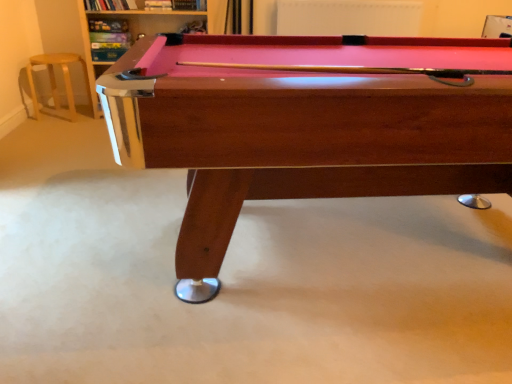
Locate an element on the screen. The image size is (512, 384). light wood bar stool at left is located at coordinates (55, 83).

In order to click on wooden billiard table at center in this screenshot , I will do `click(307, 125)`.

Is light wood bar stool at left to the left of metallic silver pool table at upper left from the viewer's perspective?

Yes.

Does point (70, 110) come behind point (139, 19)?

Yes, it is behind point (139, 19).

Does light wood bar stool at left have a smaller size compared to metallic silver pool table at upper left?

Yes.

From a real-world perspective, relative to light wood bar stool at left, is metallic silver pool table at upper left vertically above or below?

From a real-world perspective, metallic silver pool table at upper left is physically above light wood bar stool at left.

Where is `shelf above the light wood bar stool at left (from a real-world perspective)`? Image resolution: width=512 pixels, height=384 pixels. shelf above the light wood bar stool at left (from a real-world perspective) is located at coordinates (130, 31).

Consider the image. Would you consider metallic silver pool table at upper left to be distant from light wood bar stool at left?

No, metallic silver pool table at upper left is not far from light wood bar stool at left.

Can you confirm if metallic silver pool table at upper left is positioned to the left of light wood bar stool at left?

Incorrect, metallic silver pool table at upper left is not on the left side of light wood bar stool at left.

You are a GUI agent. You are given a task and a screenshot of the screen. Output one action in this format:
    pyautogui.click(x=<x>, y=<y>)
    Task: Click on the bar stool on the left of wooden billiard table at center
    The image size is (512, 384).
    Given the screenshot: What is the action you would take?
    pyautogui.click(x=55, y=83)

Is wooden billiard table at center smaller than light wood bar stool at left?

Actually, wooden billiard table at center might be larger than light wood bar stool at left.

Does wooden billiard table at center turn towards light wood bar stool at left?

No, wooden billiard table at center is not turned towards light wood bar stool at left.

Measure the distance from wooden billiard table at center to light wood bar stool at left.

The distance of wooden billiard table at center from light wood bar stool at left is 2.31 meters.

What's the angular difference between wooden billiard table at center and metallic silver pool table at upper left's facing directions?

The facing directions of wooden billiard table at center and metallic silver pool table at upper left are 1.17 degrees apart.

Is wooden billiard table at center taller or shorter than metallic silver pool table at upper left?

wooden billiard table at center is shorter than metallic silver pool table at upper left.

Which object is further away from the camera, wooden billiard table at center or metallic silver pool table at upper left?

metallic silver pool table at upper left.

Considering the sizes of objects wooden billiard table at center and metallic silver pool table at upper left in the image provided, who is thinner, wooden billiard table at center or metallic silver pool table at upper left?

With smaller width is metallic silver pool table at upper left.

Where is `billiard table below the metallic silver pool table at upper left (from the image's perspective)`? billiard table below the metallic silver pool table at upper left (from the image's perspective) is located at coordinates click(307, 125).

Who is taller, metallic silver pool table at upper left or wooden billiard table at center?

metallic silver pool table at upper left.

Is wooden billiard table at center a part of metallic silver pool table at upper left?

Actually, wooden billiard table at center is outside metallic silver pool table at upper left.

Is light wood bar stool at left beside wooden billiard table at center?

No, light wood bar stool at left is not with wooden billiard table at center.

From their relative heights in the image, would you say light wood bar stool at left is taller or shorter than wooden billiard table at center?

Clearly, light wood bar stool at left is shorter compared to wooden billiard table at center.

From a real-world perspective, is light wood bar stool at left physically below wooden billiard table at center?

Yes, from a real-world perspective, light wood bar stool at left is below wooden billiard table at center.

Considering the relative sizes of light wood bar stool at left and wooden billiard table at center in the image provided, is light wood bar stool at left thinner than wooden billiard table at center?

Yes, light wood bar stool at left is thinner than wooden billiard table at center.

This screenshot has width=512, height=384. In the image, there is a light wood bar stool at left. Find the location of `shelf above it (from the image's perspective)`. shelf above it (from the image's perspective) is located at coordinates (130, 31).

Identify the location of shelf that appears on the right of light wood bar stool at left. The image size is (512, 384). (130, 31).

Estimate the real-world distances between objects in this image. Which object is closer to light wood bar stool at left, metallic silver pool table at upper left or wooden billiard table at center?

Among the two, metallic silver pool table at upper left is located nearer to light wood bar stool at left.

From the image, which object appears to be farther from metallic silver pool table at upper left, light wood bar stool at left or wooden billiard table at center?

Based on the image, wooden billiard table at center appears to be further to metallic silver pool table at upper left.

When comparing their distances from wooden billiard table at center, does light wood bar stool at left or metallic silver pool table at upper left seem closer?

metallic silver pool table at upper left.

Based on their spatial positions, is wooden billiard table at center or light wood bar stool at left closer to metallic silver pool table at upper left?

light wood bar stool at left.

When comparing their distances from wooden billiard table at center, does metallic silver pool table at upper left or light wood bar stool at left seem closer?

metallic silver pool table at upper left is positioned closer to the anchor wooden billiard table at center.

Based on the photo, considering their positions, is wooden billiard table at center positioned further to light wood bar stool at left than metallic silver pool table at upper left?

Based on the image, wooden billiard table at center appears to be further to light wood bar stool at left.

Where is `shelf positioned between wooden billiard table at center and light wood bar stool at left from near to far`? The image size is (512, 384). shelf positioned between wooden billiard table at center and light wood bar stool at left from near to far is located at coordinates (130, 31).